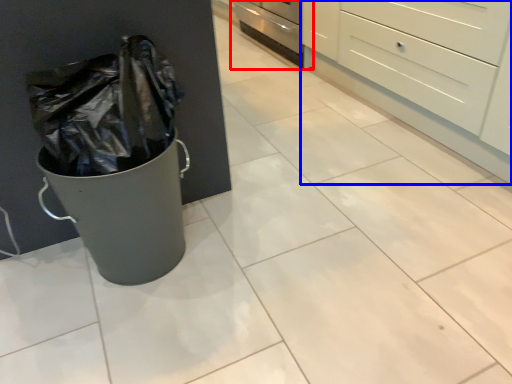
Question: Among these objects, which one is farthest to the camera, oven (highlighted by a red box) or chest of drawers (highlighted by a blue box)?

Choices:
 (A) oven
 (B) chest of drawers

Answer: (A)